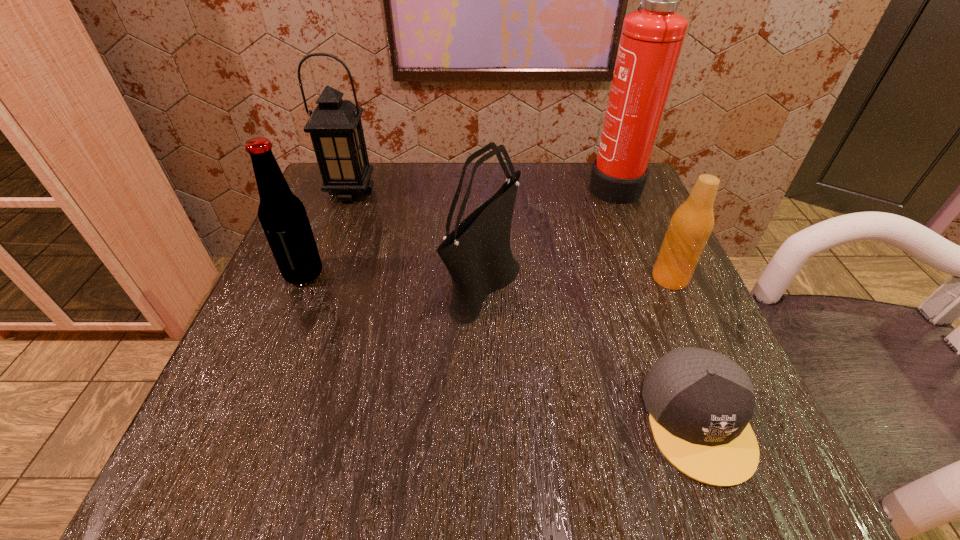
Identify which object is the fifth closest to the cap. Please provide its 2D coordinates. Your answer should be formatted as a tuple, i.e. [(x, y)], where the tuple contains the x and y coordinates of a point satisfying the conditions above.

[(335, 127)]

Where is `vacant space that satisfies the following two spatial constraints: 1. on the front side of the left beer bottle; 2. on the left side of the fifth tallest object`? The image size is (960, 540). vacant space that satisfies the following two spatial constraints: 1. on the front side of the left beer bottle; 2. on the left side of the fifth tallest object is located at coordinates (302, 278).

Where is `free space that satisfies the following two spatial constraints: 1. on the back side of the lantern; 2. on the right side of the taller beer bottle`? free space that satisfies the following two spatial constraints: 1. on the back side of the lantern; 2. on the right side of the taller beer bottle is located at coordinates (339, 192).